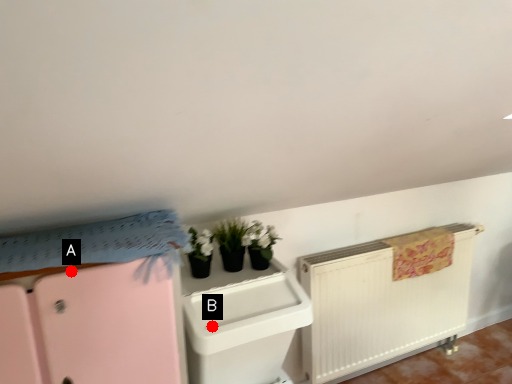
Question: Two points are circled on the image, labeled by A and B beside each circle. Which point appears farthest from the camera in this image?

Choices:
 (A) A is further
 (B) B is further

Answer: (B)